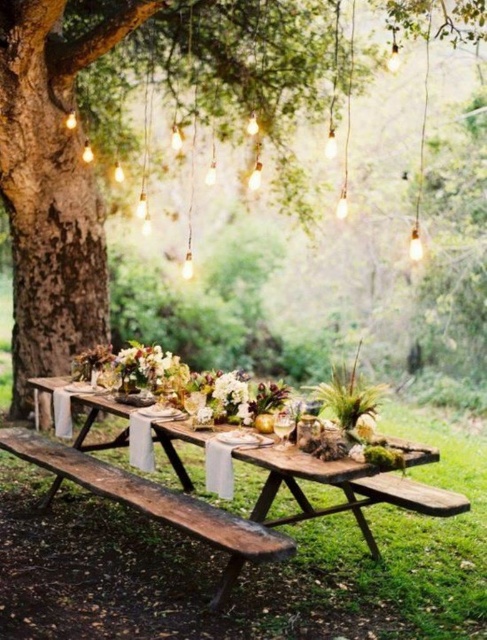
Who is higher up, brown wooden tree trunk at center or rustic wood bench at center?

brown wooden tree trunk at center is higher up.

Does brown wooden tree trunk at center have a lesser height compared to rustic wood bench at center?

No.

Identify the location of brown wooden tree trunk at center. (82, 136).

Identify the location of brown wooden tree trunk at center. (82, 136).

Between point (278, 83) and point (342, 472), which one is positioned in front?

Positioned in front is point (342, 472).

Locate an element on the screen. The image size is (487, 640). brown wooden tree trunk at center is located at coordinates click(82, 136).

This screenshot has height=640, width=487. I want to click on brown wooden tree trunk at center, so click(x=82, y=136).

What are the coordinates of `brown wooden tree trunk at center` in the screenshot? It's located at (82, 136).

Between brown wooden tree trunk at center and rustic wooden table at center, which one is positioned higher?

brown wooden tree trunk at center is above.

Does brown wooden tree trunk at center have a greater height compared to rustic wooden table at center?

Correct, brown wooden tree trunk at center is much taller as rustic wooden table at center.

Which is in front, point (81, 337) or point (295, 481)?

Point (295, 481)

In order to click on brown wooden tree trunk at center in this screenshot , I will do `click(82, 136)`.